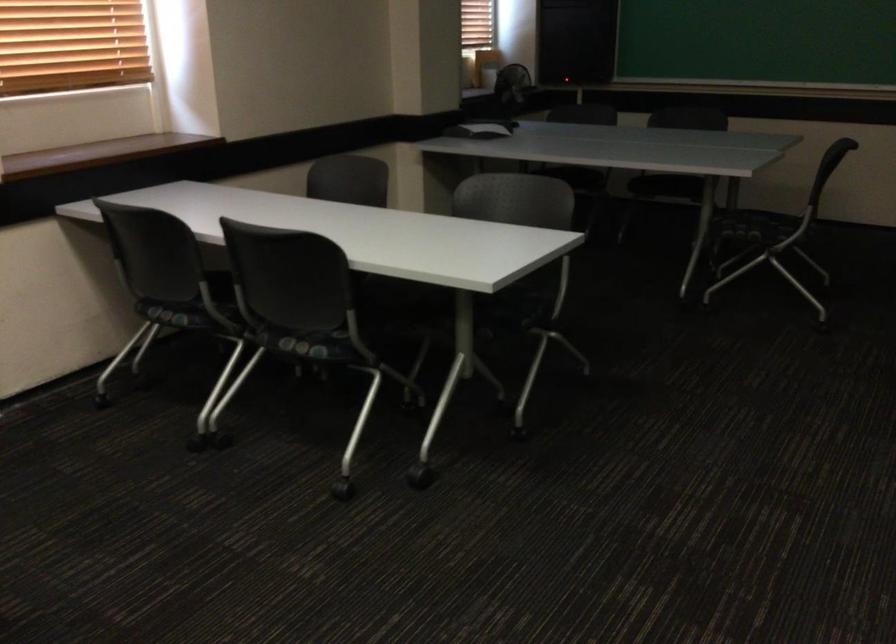
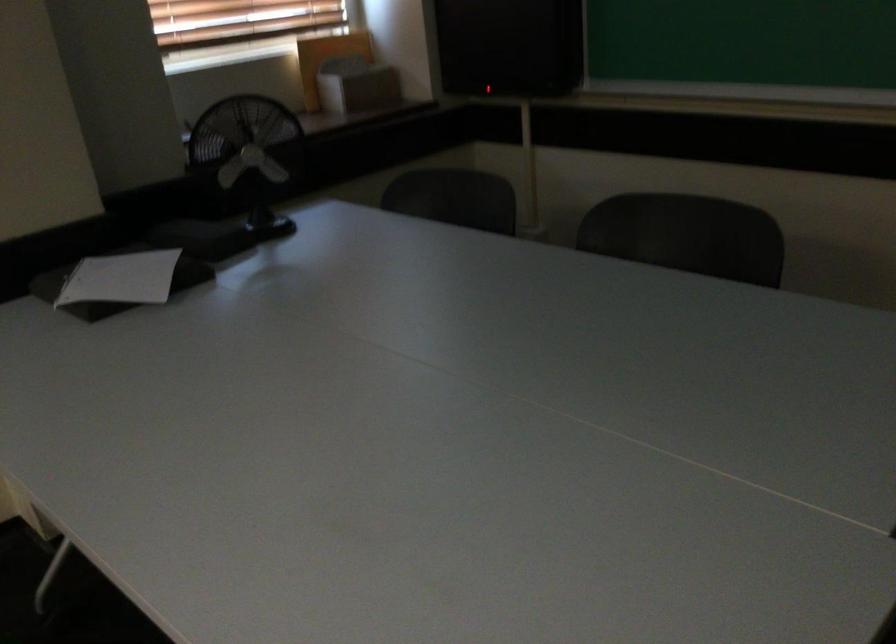
Which direction would the cameraman need to move to produce the second image?

The cameraman walked toward right, forward.